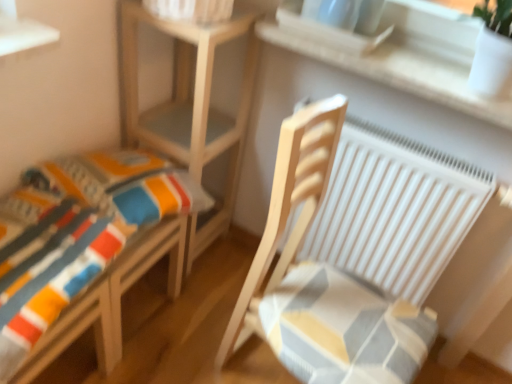
Question: Considering the relative sizes of wooden rocking chair at right and white matte radiator at right in the image provided, is wooden rocking chair at right smaller than white matte radiator at right?

Choices:
 (A) yes
 (B) no

Answer: (B)

Question: Is wooden rocking chair at right not inside white matte radiator at right?

Choices:
 (A) yes
 (B) no

Answer: (A)

Question: From a real-world perspective, is wooden rocking chair at right over white matte radiator at right?

Choices:
 (A) yes
 (B) no

Answer: (A)

Question: Considering the relative sizes of wooden rocking chair at right and white matte radiator at right in the image provided, is wooden rocking chair at right bigger than white matte radiator at right?

Choices:
 (A) yes
 (B) no

Answer: (A)

Question: Is wooden rocking chair at right aimed at white matte radiator at right?

Choices:
 (A) no
 (B) yes

Answer: (A)

Question: Is white matte radiator at right inside or outside of wooden rocking chair at right?

Choices:
 (A) outside
 (B) inside

Answer: (A)

Question: Does point [402, 243] appear closer or farther from the camera than point [395, 336]?

Choices:
 (A) closer
 (B) farther

Answer: (B)

Question: In terms of width, does white matte radiator at right look wider or thinner when compared to wooden rocking chair at right?

Choices:
 (A) wide
 (B) thin

Answer: (B)

Question: From a real-world perspective, is white matte radiator at right positioned above or below wooden rocking chair at right?

Choices:
 (A) above
 (B) below

Answer: (B)

Question: From their relative heights in the image, would you say natural wood table at center is taller or shorter than white stone window sill at upper center?

Choices:
 (A) tall
 (B) short

Answer: (A)

Question: Considering the positions of natural wood table at center and white stone window sill at upper center in the image, is natural wood table at center wider or thinner than white stone window sill at upper center?

Choices:
 (A) wide
 (B) thin

Answer: (B)

Question: From a real-world perspective, is natural wood table at center above or below white stone window sill at upper center?

Choices:
 (A) below
 (B) above

Answer: (A)

Question: Is natural wood table at center in front of or behind white stone window sill at upper center in the image?

Choices:
 (A) front
 (B) behind

Answer: (B)

Question: Is natural wood table at center to the left or to the right of striped fabric cushion at lower left in the image?

Choices:
 (A) right
 (B) left

Answer: (A)

Question: Looking at the image, does natural wood table at center seem bigger or smaller compared to striped fabric cushion at lower left?

Choices:
 (A) small
 (B) big

Answer: (B)